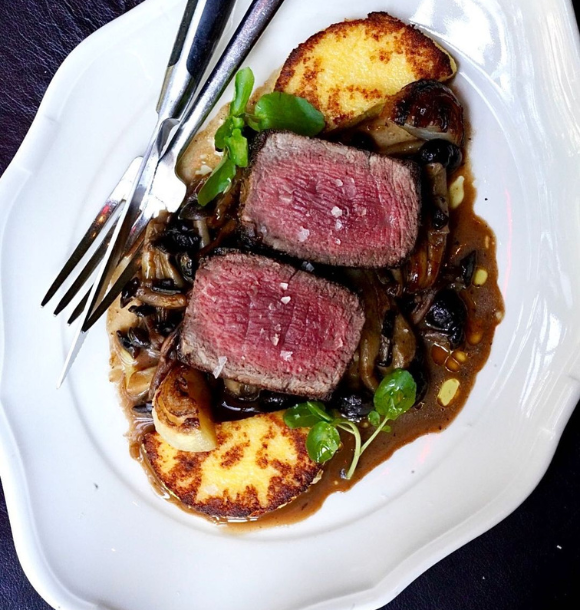
Identify the location of table space. The width and height of the screenshot is (580, 610). (44, 38), (17, 582), (491, 560).